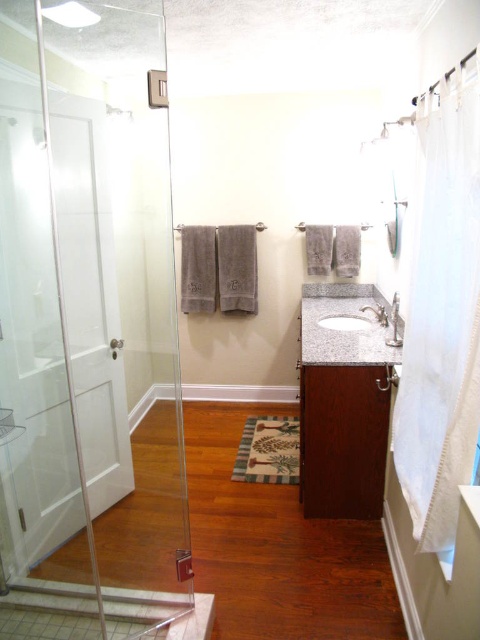
Question: Which point is farther from the camera taking this photo?

Choices:
 (A) (375, 440)
 (B) (326, 324)

Answer: (B)

Question: Which point appears farthest from the camera in this image?

Choices:
 (A) (313, 428)
 (B) (20, 573)

Answer: (A)

Question: Observing the image, what is the correct spatial positioning of transparent glass shower door at left in reference to dark wood cabinet at center?

Choices:
 (A) left
 (B) right

Answer: (A)

Question: From the image, what is the correct spatial relationship of transparent glass shower door at left in relation to granite/stone sink at center?

Choices:
 (A) below
 (B) above

Answer: (B)

Question: Is transparent glass shower door at left to the left of dark wood cabinet at center from the viewer's perspective?

Choices:
 (A) yes
 (B) no

Answer: (A)

Question: Which is nearer to the transparent glass shower door at left?

Choices:
 (A) granite/stone sink at center
 (B) dark wood cabinet at center

Answer: (B)